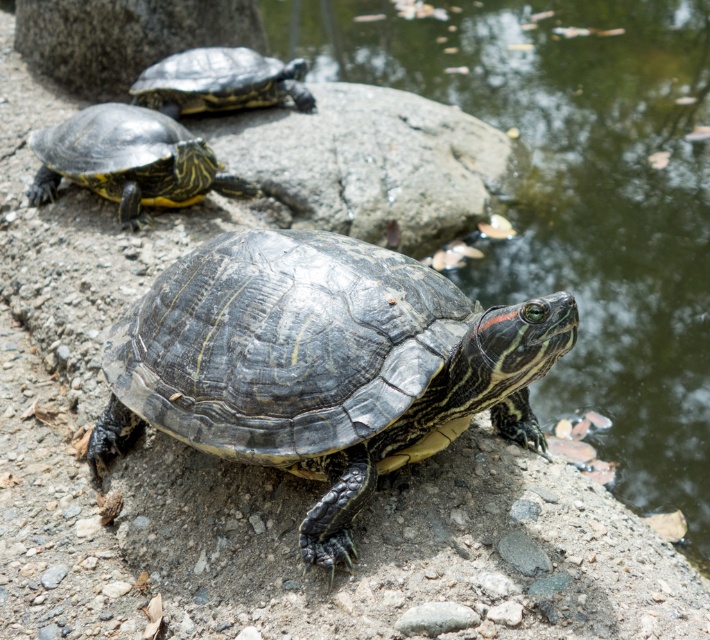
Who is shorter, shiny black turtle at left or shiny black turtle at upper center?

shiny black turtle at upper center is shorter.

Who is lower down, shiny black turtle at left or shiny black turtle at upper center?

shiny black turtle at left is below.

Locate an element on the screen. Image resolution: width=710 pixels, height=640 pixels. shiny black turtle at left is located at coordinates [x=129, y=161].

Identify the location of glossy water at center. (574, 198).

Is point (639, 72) positioned after point (131, 131)?

Yes.

Can you confirm if glossy water at center is smaller than shiny black turtle at left?

Incorrect, glossy water at center is not smaller in size than shiny black turtle at left.

Locate an element on the screen. The height and width of the screenshot is (640, 710). glossy water at center is located at coordinates (574, 198).